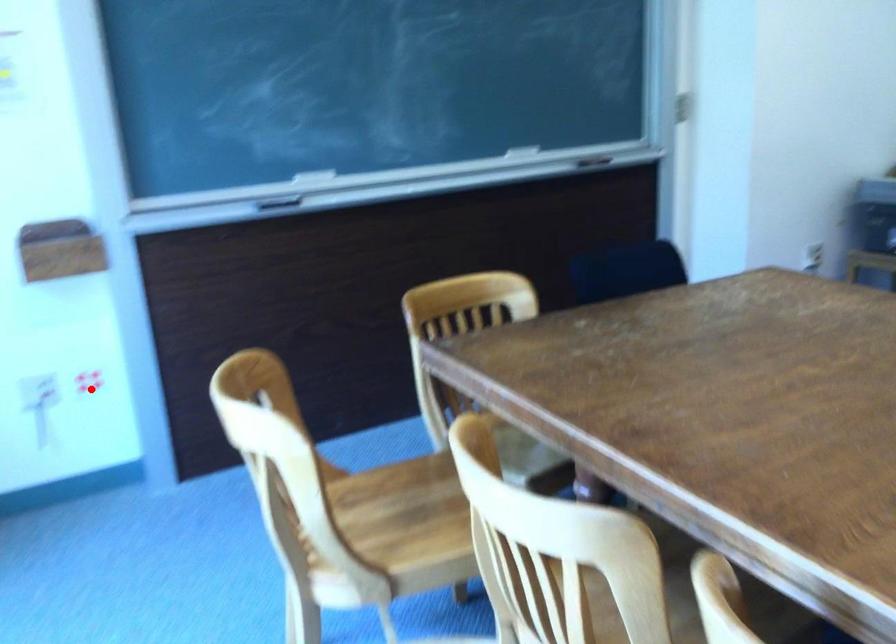
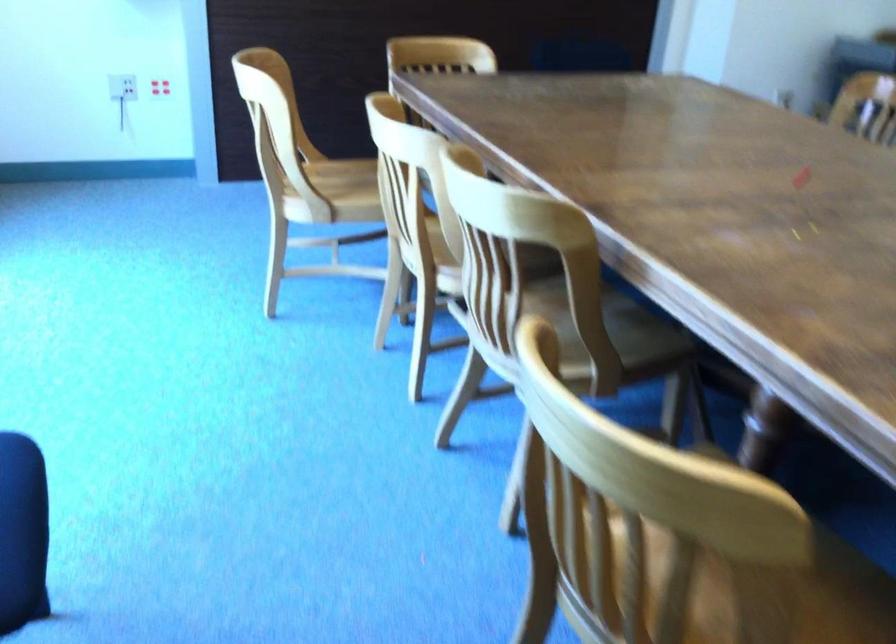
Question: I am providing you with two images of the same scene from different viewpoints. Image1 has a red point marked. In image2, the corresponding 3D location appears at what relative position? Reply with the corresponding letter.

Choices:
 (A) Closer
 (B) Farther

Answer: (B)